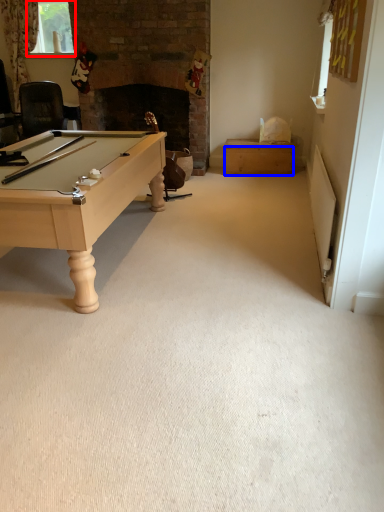
Question: Which object is further to the camera taking this photo, window screen (highlighted by a red box) or drawer (highlighted by a blue box)?

Choices:
 (A) window screen
 (B) drawer

Answer: (A)